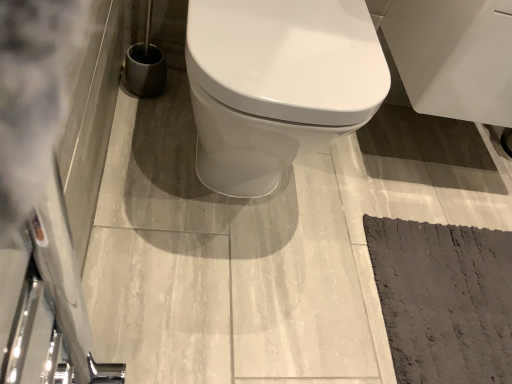
Image resolution: width=512 pixels, height=384 pixels. I want to click on free area below dark gray textured mat at lower right (from a real-world perspective), so click(x=451, y=292).